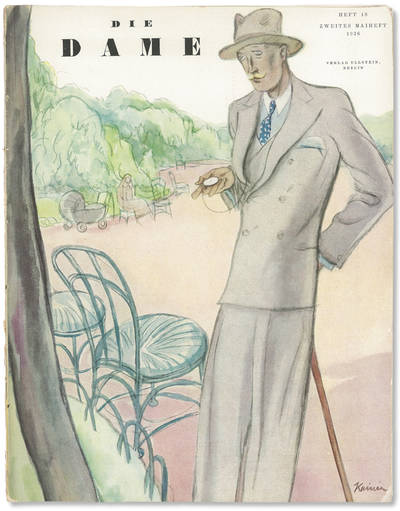
Find the location of `chair`. chair is located at coordinates tap(175, 364).